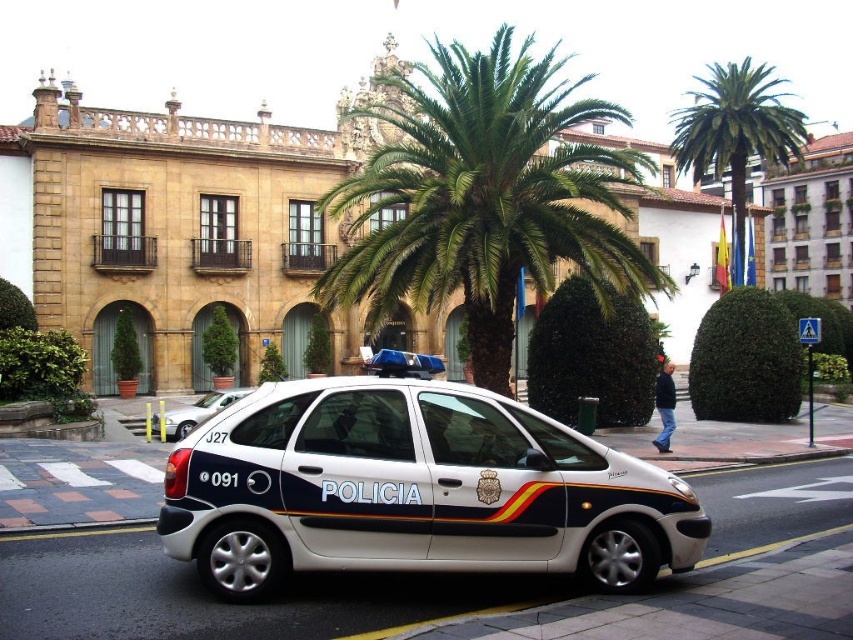
Does green leafy palm tree at center appear on the right side of white glossy police van at center?

Indeed, green leafy palm tree at center is positioned on the right side of white glossy police van at center.

Does point (351, 198) come behind point (370, 362)?

No, (351, 198) is closer to viewer.

Between point (515, 122) and point (376, 358), which one is positioned behind?

Point (515, 122)

Locate an element on the screen. The height and width of the screenshot is (640, 853). green leafy palm tree at center is located at coordinates (485, 198).

Between white metallic police car at center and white matte car at center, which one is positioned lower?

Positioned lower is white matte car at center.

Looking at this image, measure the distance from white metallic police car at center to white matte car at center.

A distance of 29.19 meters exists between white metallic police car at center and white matte car at center.

Does point (279, 524) lie in front of point (212, 394)?

Yes, point (279, 524) is closer to viewer.

This screenshot has width=853, height=640. Find the location of `white metallic police car at center`. white metallic police car at center is located at coordinates (413, 490).

Which of these two, green leafy palm tree at upper center or matte white car at center, stands shorter?

Standing shorter between the two is matte white car at center.

Based on the photo, is green leafy palm tree at upper center taller than matte white car at center?

Correct, green leafy palm tree at upper center is much taller as matte white car at center.

Is point (740, 157) farther from camera compared to point (662, 385)?

Yes, point (740, 157) is behind point (662, 385).

Find the location of a particular element. The image size is (853, 640). green leafy palm tree at upper center is located at coordinates (735, 132).